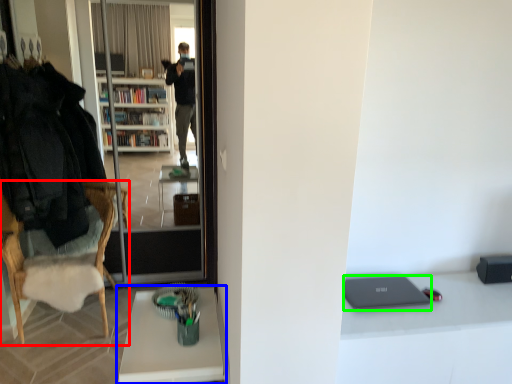
Question: Considering the real-world distances, which object is closest to chair (highlighted by a red box)? desk (highlighted by a blue box) or laptop (highlighted by a green box).

Choices:
 (A) desk
 (B) laptop

Answer: (A)